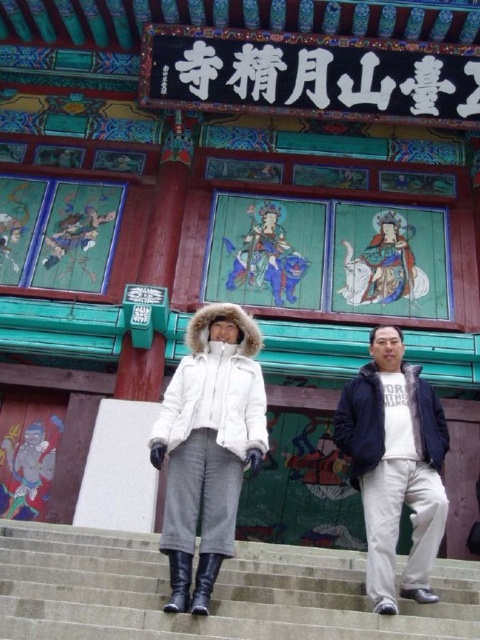
You are a photographer trying to capture a photo of the gray concrete stairs at center and the white cotton pants at right. Which object is positioned closer to the camera lens?

The gray concrete stairs at center is closer to the viewer than the white cotton pants at right, so the stairs will appear closer to the camera lens.

You are standing at the bottom of the gray concrete stairs at center and want to reach the white cotton pants at right. Which direction should you move to get closer to them?

The gray concrete stairs at center is above the white cotton pants at right, so you should move downward towards the white cotton pants at right to get closer.